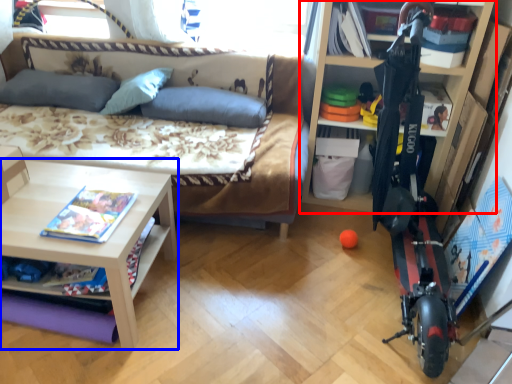
Question: Which of the following is the farthest to the observer, shelf (highlighted by a red box) or table (highlighted by a blue box)?

Choices:
 (A) shelf
 (B) table

Answer: (A)